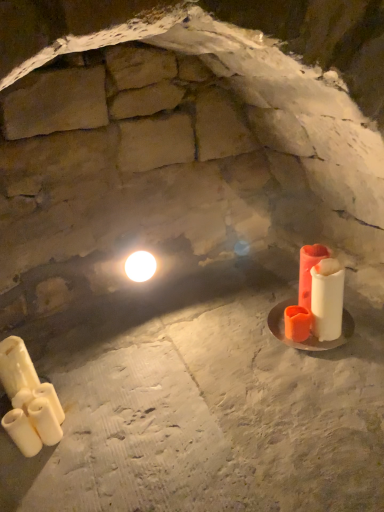
Describe the element at coordinates (50, 399) in the screenshot. I see `white matte candle at lower left, which is the 3th candle in right-to-left order` at that location.

This screenshot has width=384, height=512. What do you see at coordinates (28, 401) in the screenshot?
I see `white matte candle at lower left, the 1th candle positioned from the left` at bounding box center [28, 401].

The width and height of the screenshot is (384, 512). I want to click on matte orange candle at right, acting as the 5th candle starting from the left, so click(309, 271).

What is the approximate height of white matte candle at lower left, the fourth candle from the left?

white matte candle at lower left, the fourth candle from the left, is 5.25 inches in height.

Measure the distance between point (x=14, y=439) and camera.

Point (x=14, y=439) and camera are 1.15 meters apart from each other.

I want to click on white matte candle at lower left, placed as the 3th candle when sorted from left to right, so click(x=50, y=399).

Who is taller, white matte candle at lower left, positioned as the second candle in right-to-left order, or white matte candle at lower left, which is the 3th candle in right-to-left order?

white matte candle at lower left, which is the 3th candle in right-to-left order.

Considering the positions of objects white matte candle at lower left, the fourth candle from the left, and white matte candle at lower left, placed as the 3th candle when sorted from left to right, in the image provided, who is in front, white matte candle at lower left, the fourth candle from the left, or white matte candle at lower left, placed as the 3th candle when sorted from left to right,?

white matte candle at lower left, the fourth candle from the left, is more forward.

Would you say white matte candle at lower left, positioned as the second candle in right-to-left order, is outside white matte candle at lower left, which is the 3th candle in right-to-left order?

white matte candle at lower left, positioned as the second candle in right-to-left order, lies outside white matte candle at lower left, which is the 3th candle in right-to-left order,'s area.

Considering the relative sizes of white matte candle at lower left, placed as the 3th candle when sorted from left to right, and white matte candle at lower left, arranged as the fourth candle when viewed from the right, in the image provided, is white matte candle at lower left, placed as the 3th candle when sorted from left to right, thinner than white matte candle at lower left, arranged as the fourth candle when viewed from the right,?

No.

From a real-world perspective, between white matte candle at lower left, placed as the 3th candle when sorted from left to right, and white matte candle at lower left, which ranks as the second candle in left-to-right order, who is vertically lower?

From a 3D spatial view, white matte candle at lower left, placed as the 3th candle when sorted from left to right, is below.

Find the location of `candle that appears below the white matte candle at lower left, arranged as the fourth candle when viewed from the right (from a real-world perspective)`. candle that appears below the white matte candle at lower left, arranged as the fourth candle when viewed from the right (from a real-world perspective) is located at coordinates pyautogui.click(x=50, y=399).

Is point (52, 393) more distant than point (28, 445)?

Yes, point (52, 393) is farther from viewer.

Find the location of `candle lying on the right of white glossy light bulb at upper center`. candle lying on the right of white glossy light bulb at upper center is located at coordinates (309, 271).

Consider the image. From the image's perspective, would you say white glossy light bulb at upper center is shown under matte orange candle at right, acting as the 5th candle starting from the left?

Incorrect, from the image's perspective, white glossy light bulb at upper center is higher than matte orange candle at right, acting as the 5th candle starting from the left.

Is there a large distance between white glossy light bulb at upper center and matte orange candle at right, acting as the first candle starting from the right?

white glossy light bulb at upper center is near matte orange candle at right, acting as the first candle starting from the right, not far away.

Considering the relative positions of white glossy light bulb at upper center and matte orange candle at right, acting as the first candle starting from the right, in the image provided, is white glossy light bulb at upper center to the right of matte orange candle at right, acting as the first candle starting from the right, from the viewer's perspective?

Incorrect, white glossy light bulb at upper center is not on the right side of matte orange candle at right, acting as the first candle starting from the right.

In terms of height, does white glossy light bulb at upper center look taller or shorter compared to white matte candle at lower left, placed as the 3th candle when sorted from left to right?

white glossy light bulb at upper center is shorter than white matte candle at lower left, placed as the 3th candle when sorted from left to right.

How far apart are white glossy light bulb at upper center and white matte candle at lower left, placed as the 3th candle when sorted from left to right?

white glossy light bulb at upper center is 24.07 inches away from white matte candle at lower left, placed as the 3th candle when sorted from left to right.

Could you tell me if white glossy light bulb at upper center is facing white matte candle at lower left, placed as the 3th candle when sorted from left to right?

No.

From a real-world perspective, which object stands above the other?

In real-world perspective, white glossy light bulb at upper center is above.

Considering the positions of objects white matte candle at lower left, positioned as the second candle in right-to-left order, and white glossy light bulb at upper center in the image provided, who is more to the right, white matte candle at lower left, positioned as the second candle in right-to-left order, or white glossy light bulb at upper center?

white glossy light bulb at upper center.

Is white matte candle at lower left, positioned as the second candle in right-to-left order, smaller than white glossy light bulb at upper center?

Yes, white matte candle at lower left, positioned as the second candle in right-to-left order, is smaller than white glossy light bulb at upper center.

Which object is closer to the camera taking this photo, white matte candle at lower left, the fourth candle from the left, or white glossy light bulb at upper center?

white matte candle at lower left, the fourth candle from the left, is closer to the camera.

From a real-world perspective, is white matte candle at lower left, positioned as the second candle in right-to-left order, positioned over white glossy light bulb at upper center based on gravity?

No, from a real-world perspective, white matte candle at lower left, positioned as the second candle in right-to-left order, is not on top of white glossy light bulb at upper center.

Is matte orange candle at right, acting as the 5th candle starting from the left, aimed at white glossy light bulb at upper center?

No, matte orange candle at right, acting as the 5th candle starting from the left, is not facing towards white glossy light bulb at upper center.

Consider the image. Visually, is matte orange candle at right, acting as the first candle starting from the right, positioned to the left or to the right of white glossy light bulb at upper center?

Based on their positions, matte orange candle at right, acting as the first candle starting from the right, is located to the right of white glossy light bulb at upper center.

How many degrees apart are the facing directions of matte orange candle at right, acting as the first candle starting from the right, and white glossy light bulb at upper center?

They differ by 1.58 degrees in their facing directions.

Is point (310, 265) positioned behind point (126, 270)?

No.

From the picture: From the image's perspective, is white matte candle at lower left, which is the 3th candle in right-to-left order, on top of white glossy light bulb at upper center?

No, from the image's perspective, white matte candle at lower left, which is the 3th candle in right-to-left order, is not above white glossy light bulb at upper center.

Which is less distant, [51,386] or [131,263]?

Point [51,386] is positioned closer to the camera compared to point [131,263].

Between white matte candle at lower left, placed as the 3th candle when sorted from left to right, and white glossy light bulb at upper center, which one has more height?

Standing taller between the two is white matte candle at lower left, placed as the 3th candle when sorted from left to right.

Is white matte candle at lower left, placed as the 3th candle when sorted from left to right, far away from white glossy light bulb at upper center?

Actually, white matte candle at lower left, placed as the 3th candle when sorted from left to right, and white glossy light bulb at upper center are a little close together.

Starting from the white matte candle at lower left, positioned as the second candle in right-to-left order, which candle is the 1st one behind? Please provide its 2D coordinates.

[(50, 399)]

Locate an element on the screen. the 1st candle counting from the right of the white matte candle at lower left, which ranks as the second candle in left-to-right order is located at coordinates (50, 399).

From the image, which object appears to be farther from white matte candle at lower left, which is the 3th candle in right-to-left order, white glossy light bulb at upper center or matte orange candle at right, acting as the first candle starting from the right?

The object further to white matte candle at lower left, which is the 3th candle in right-to-left order, is matte orange candle at right, acting as the first candle starting from the right.

From the image, which object appears to be nearer to white glossy light bulb at upper center, white matte candle at lower left, which ranks as the second candle in left-to-right order, or white matte candle at lower left, the fourth candle from the left?

Among the two, white matte candle at lower left, the fourth candle from the left, is located nearer to white glossy light bulb at upper center.

Looking at this image, which object lies nearer to the anchor point white matte candle at lower left, the 1th candle positioned from the left, white glossy light bulb at upper center or white matte candle at lower left, the fourth candle from the left?

The object closer to white matte candle at lower left, the 1th candle positioned from the left, is white matte candle at lower left, the fourth candle from the left.

When comparing their distances from white matte candle at lower left, arranged as the fourth candle when viewed from the right, does white matte candle at lower left, positioned as the second candle in right-to-left order, or white matte candle at lower left, which is counted as the 5th candle, starting from the right, seem closer?

A: white matte candle at lower left, positioned as the second candle in right-to-left order.

Which object lies nearer to the anchor point white matte candle at lower left, the fourth candle from the left, white matte candle at lower left, which is counted as the 5th candle, starting from the right, or matte orange candle at right, acting as the 5th candle starting from the left?

Among the two, white matte candle at lower left, which is counted as the 5th candle, starting from the right, is located nearer to white matte candle at lower left, the fourth candle from the left.

From the image, which object appears to be nearer to white matte candle at lower left, which is the 3th candle in right-to-left order, white matte candle at lower left, the 1th candle positioned from the left, or white matte candle at lower left, positioned as the second candle in right-to-left order?

white matte candle at lower left, positioned as the second candle in right-to-left order, is closer to white matte candle at lower left, which is the 3th candle in right-to-left order.

When comparing their distances from white matte candle at lower left, positioned as the second candle in right-to-left order, does white matte candle at lower left, which ranks as the second candle in left-to-right order, or white glossy light bulb at upper center seem closer?

white matte candle at lower left, which ranks as the second candle in left-to-right order, is positioned closer to the anchor white matte candle at lower left, positioned as the second candle in right-to-left order.

Estimate the real-world distances between objects in this image. Which object is closer to white matte candle at lower left, which ranks as the second candle in left-to-right order, white glossy light bulb at upper center or white matte candle at lower left, placed as the 3th candle when sorted from left to right?

Among the two, white matte candle at lower left, placed as the 3th candle when sorted from left to right, is located nearer to white matte candle at lower left, which ranks as the second candle in left-to-right order.

Where is `light located between white matte candle at lower left, arranged as the fourth candle when viewed from the right, and matte orange candle at right, acting as the first candle starting from the right, in the left-right direction`? The height and width of the screenshot is (512, 384). light located between white matte candle at lower left, arranged as the fourth candle when viewed from the right, and matte orange candle at right, acting as the first candle starting from the right, in the left-right direction is located at coordinates (140, 266).

The width and height of the screenshot is (384, 512). What are the coordinates of `light located between white matte candle at lower left, positioned as the second candle in right-to-left order, and matte orange candle at right, acting as the 5th candle starting from the left, in the left-right direction` in the screenshot? It's located at (140, 266).

This screenshot has width=384, height=512. I want to click on light situated between white matte candle at lower left, which is counted as the 5th candle, starting from the right, and matte orange candle at right, acting as the 5th candle starting from the left, from left to right, so click(x=140, y=266).

The image size is (384, 512). What are the coordinates of `light situated between white matte candle at lower left, placed as the 3th candle when sorted from left to right, and matte orange candle at right, acting as the 5th candle starting from the left, from left to right` in the screenshot? It's located at (140, 266).